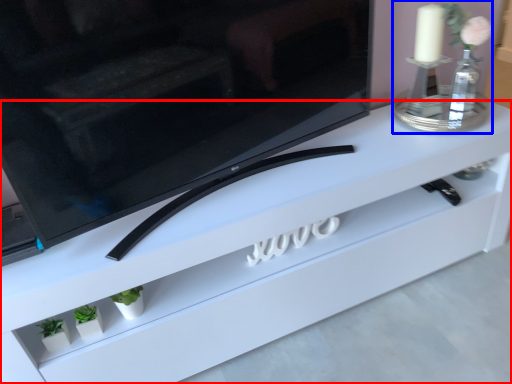
Question: Which point is closer to the camera, furniture (highlighted by a red box) or candle holder (highlighted by a blue box)?

Choices:
 (A) furniture
 (B) candle holder

Answer: (A)